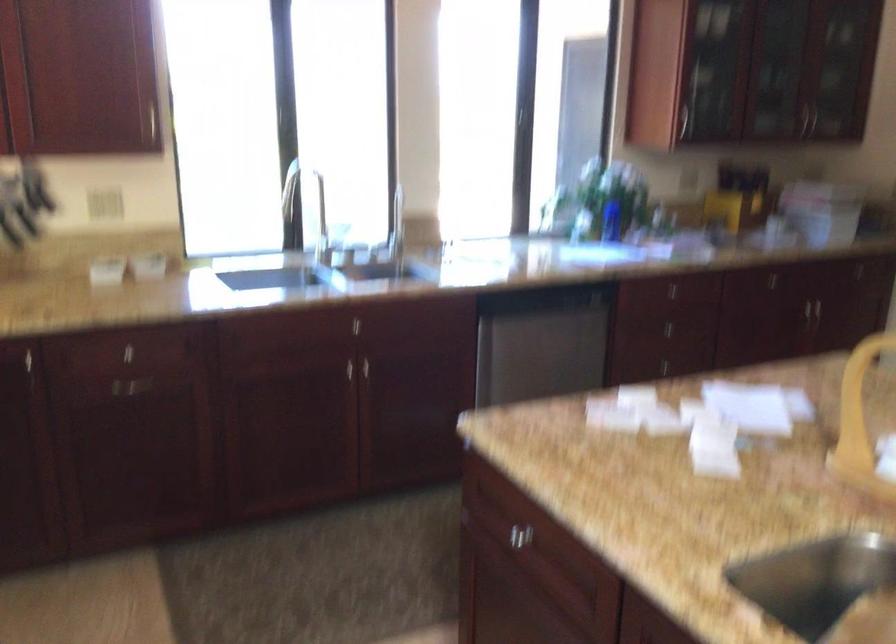
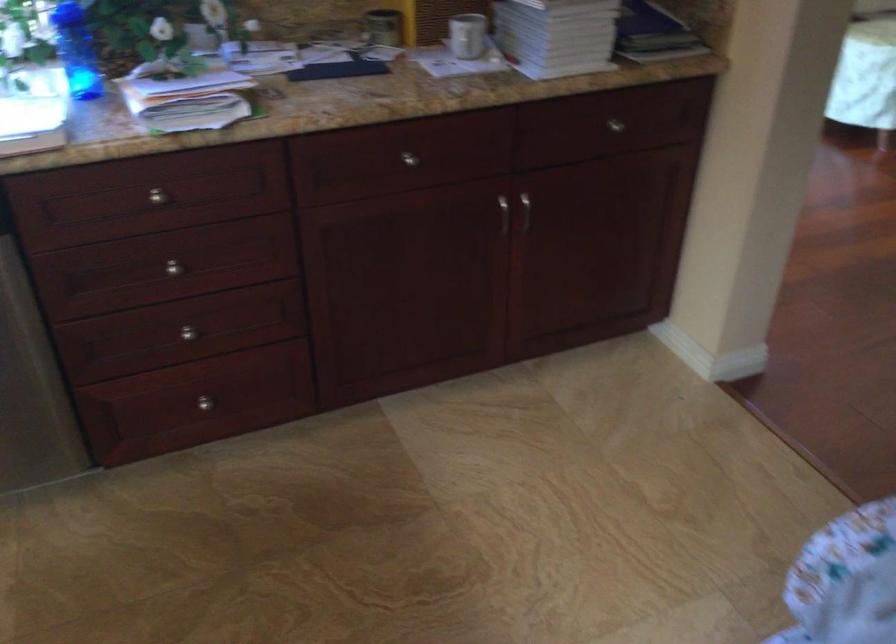
The point at (693,321) is marked in the first image. Where is the corresponding point in the second image?

(174, 267)